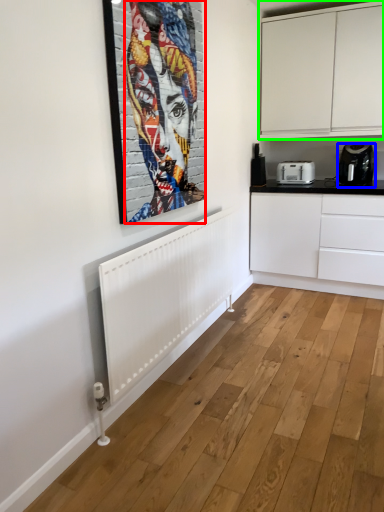
Question: Based on their relative distances, which object is nearer to person (highlighted by a red box)? Choose from home appliance (highlighted by a blue box) and cabinetry (highlighted by a green box).

Choices:
 (A) home appliance
 (B) cabinetry

Answer: (B)